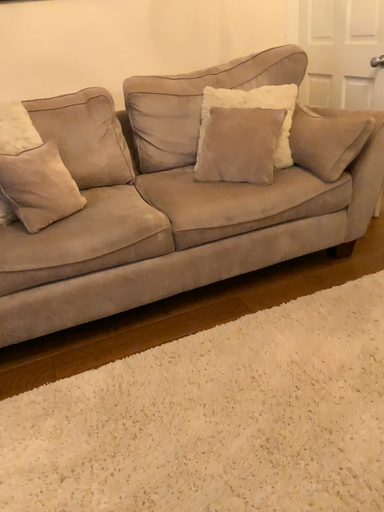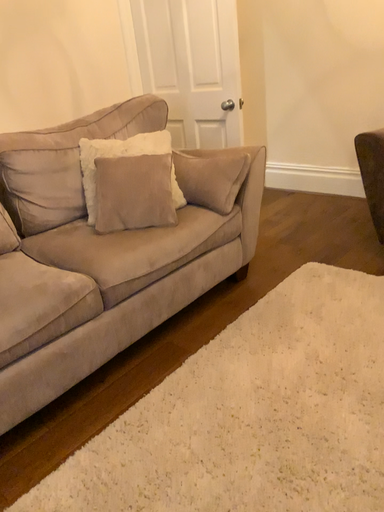
Question: Which way did the camera rotate in the video?

Choices:
 (A) rotated downward
 (B) rotated upward

Answer: (B)